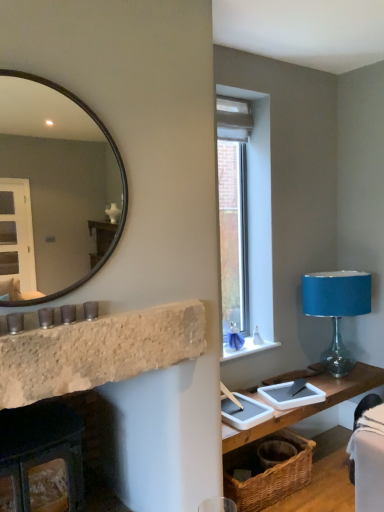
The image size is (384, 512). What are the coordinates of `free location above black glass mirror at upper left (from a real-world perspective)` in the screenshot? It's located at (61, 75).